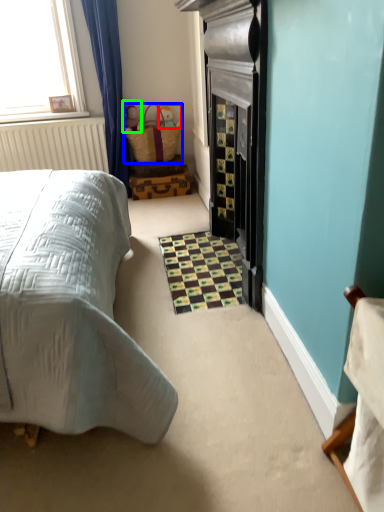
Question: Which is farther away from toy (highlighted by a red box)? basket (highlighted by a blue box) or toy (highlighted by a green box)?

Choices:
 (A) basket
 (B) toy

Answer: (B)